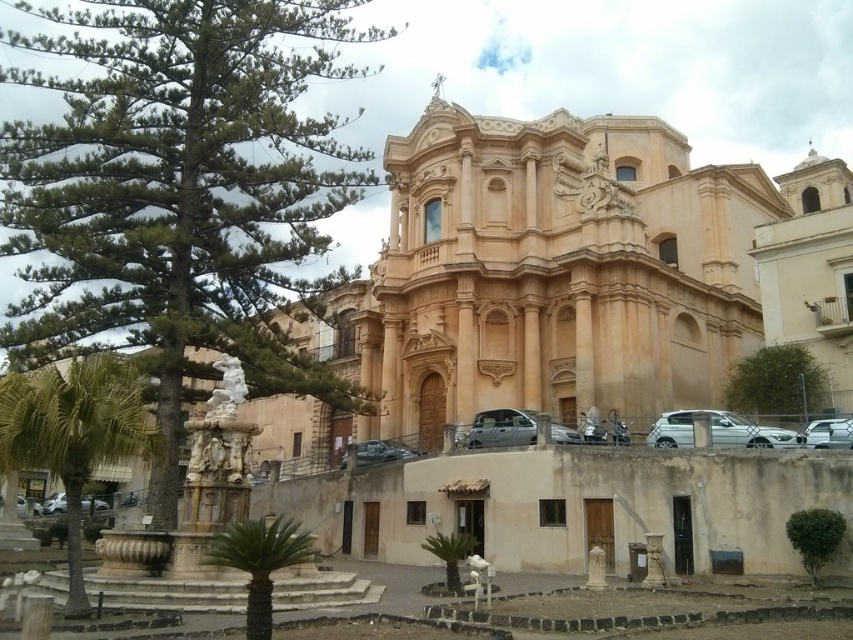
Question: Which of the following is the farthest from the observer?

Choices:
 (A) metallic silver scooter at lower center
 (B) green leafy tree at center

Answer: (B)

Question: Among these points, which one is nearest to the camera?

Choices:
 (A) (808, 387)
 (B) (346, 460)
 (C) (660, 429)

Answer: (C)

Question: Estimate the real-world distances between objects in this image. Which object is farther from the green leafy pine at center?

Choices:
 (A) satin silver car at center
 (B) green leafy palm tree at lower center
 (C) green leafy palm tree at lower left
 (D) beige stone church at center

Answer: (D)

Question: Can you confirm if green textured pine tree at left is thinner than green leafy palm tree at lower left?

Choices:
 (A) yes
 (B) no

Answer: (B)

Question: Is green leafy palm tree at lower center wider than metallic silver car at center?

Choices:
 (A) no
 (B) yes

Answer: (A)

Question: Observing the image, what is the correct spatial positioning of green leafy palm tree at lower center in reference to satin silver car at center?

Choices:
 (A) above
 (B) below

Answer: (B)